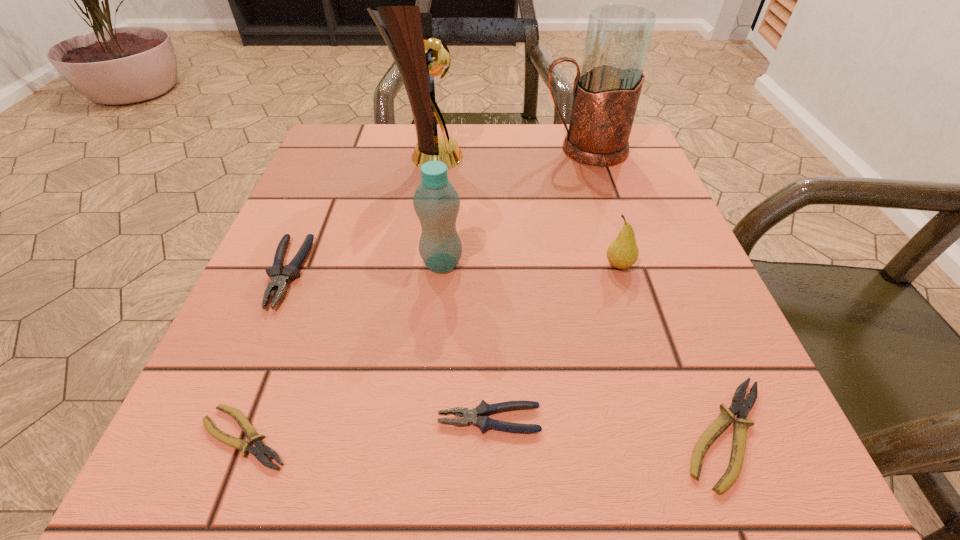
Where is `the right yellow pliers`? the right yellow pliers is located at coordinates (739, 405).

At what (x,y) coordinates should I click in order to perform the action: click on the shortest pliers. Please return your answer as a coordinate pair (x, y). Looking at the image, I should click on (260, 450).

This screenshot has width=960, height=540. What are the coordinates of `the smaller yellow pliers` in the screenshot? It's located at (260, 450).

At what (x,y) coordinates should I click in order to perform the action: click on free space located at the front of the award, where the globe is visible. Please return your answer as a coordinate pair (x, y). The image size is (960, 540). Looking at the image, I should click on (631, 157).

Locate an element on the screen. vacant space located 0.390m with the handle on the side of the seventh shortest object is located at coordinates (368, 150).

At what (x,y) coordinates should I click in order to perform the action: click on free space located 0.100m with the handle on the side of the seventh shortest object. Please return your answer as a coordinate pair (x, y). The height and width of the screenshot is (540, 960). Looking at the image, I should click on (496, 150).

Find the location of a particular element. The height and width of the screenshot is (540, 960). vacant position located with the handle on the side of the seventh shortest object is located at coordinates (420, 150).

Where is `free point located 0.110m at the front cap of the third tallest object`? free point located 0.110m at the front cap of the third tallest object is located at coordinates (528, 263).

Find the location of `vacant space situated 0.100m on the right of the pear`. vacant space situated 0.100m on the right of the pear is located at coordinates (693, 265).

Where is `vacant area situated 0.100m at the gripping part of the farthest pliers`? Image resolution: width=960 pixels, height=540 pixels. vacant area situated 0.100m at the gripping part of the farthest pliers is located at coordinates (246, 369).